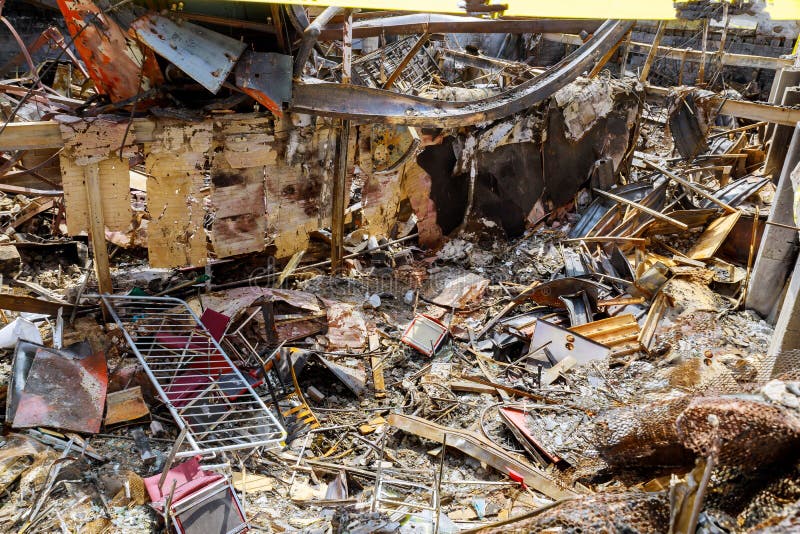
You are a GUI agent. You are given a task and a screenshot of the screen. Output one action in this format:
    pyautogui.click(x=<x>, y=<y>)
    Task: Click on the cable
    
    Given the screenshot: What is the action you would take?
    pyautogui.click(x=312, y=262)